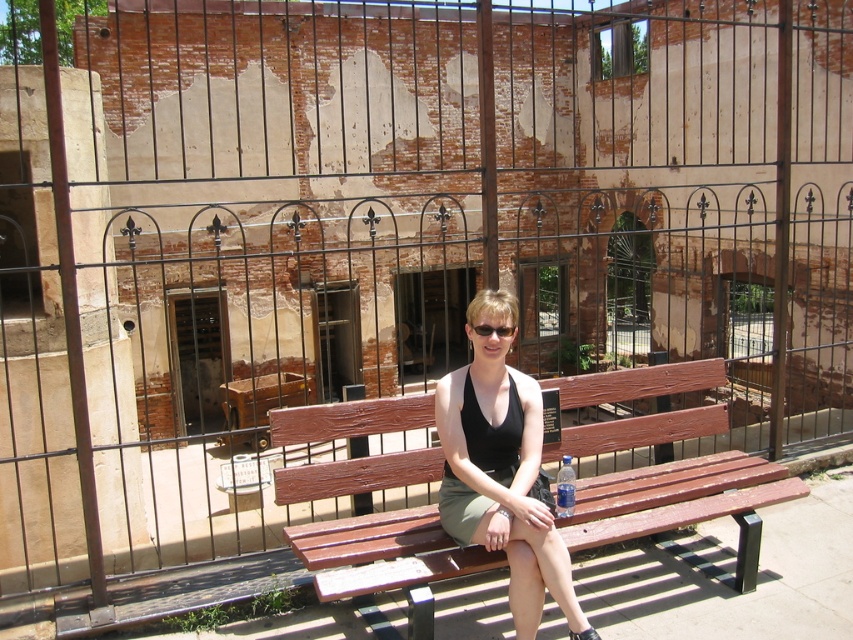
You are a photographer taking a picture of the person sitting on the bench. You notice the black fabric tank top at center and the black plastic goggles at center. Which object is closer to the camera?

The black fabric tank top at center is closer to the camera because it is in front of the black plastic goggles at center.

You are standing in front of the old brick building and see the wooden bench at center and the black plastic goggles at center. Which object is positioned to the right of the other?

The wooden bench at center is to the right of the black plastic goggles at center.